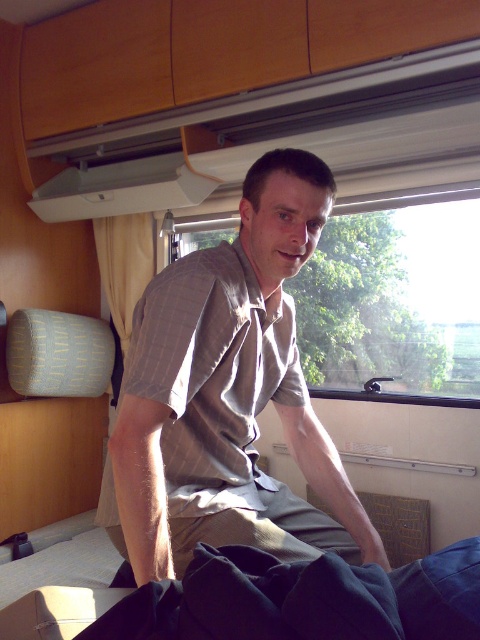
You are a passenger in a train compartment. You are wearing a gray striped shirt at center and looking out through a transparent glass window at center. Can you comfortably reach the window from your current position without moving your feet?

The gray striped shirt at center and transparent glass window at center are 4.26 feet apart from each other. Since the distance is more than an average person can reach comfortably without moving their feet, you cannot comfortably reach the window from your current position without moving your feet.

You are a passenger sitting in the train compartment. You notice a gray striped shirt at center and a transparent glass window at center. Which object is closer to the left side of the compartment?

The gray striped shirt at center is to the left of the transparent glass window at center, so it is closer to the left side of the compartment.